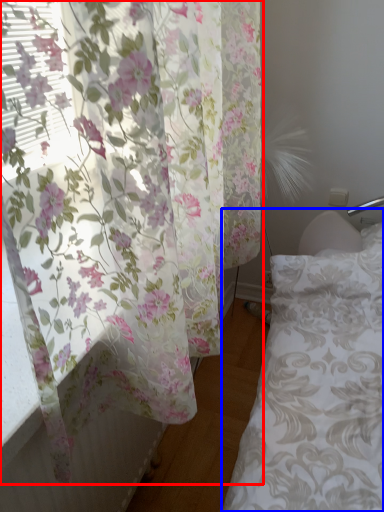
Question: Among these objects, which one is farthest to the camera, curtain (highlighted by a red box) or bed frame (highlighted by a blue box)?

Choices:
 (A) curtain
 (B) bed frame

Answer: (B)